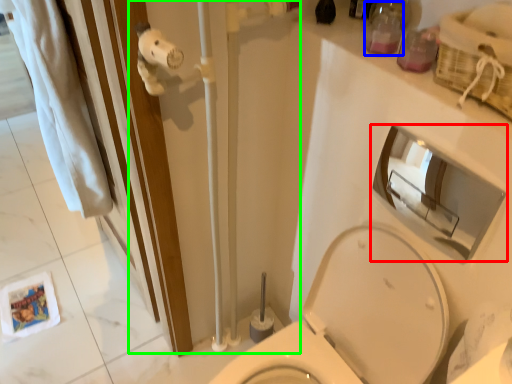
Question: Considering the real-world distances, which object is closest to mirror (highlighted by a red box)? toiletry (highlighted by a blue box) or shower door (highlighted by a green box).

Choices:
 (A) toiletry
 (B) shower door

Answer: (A)